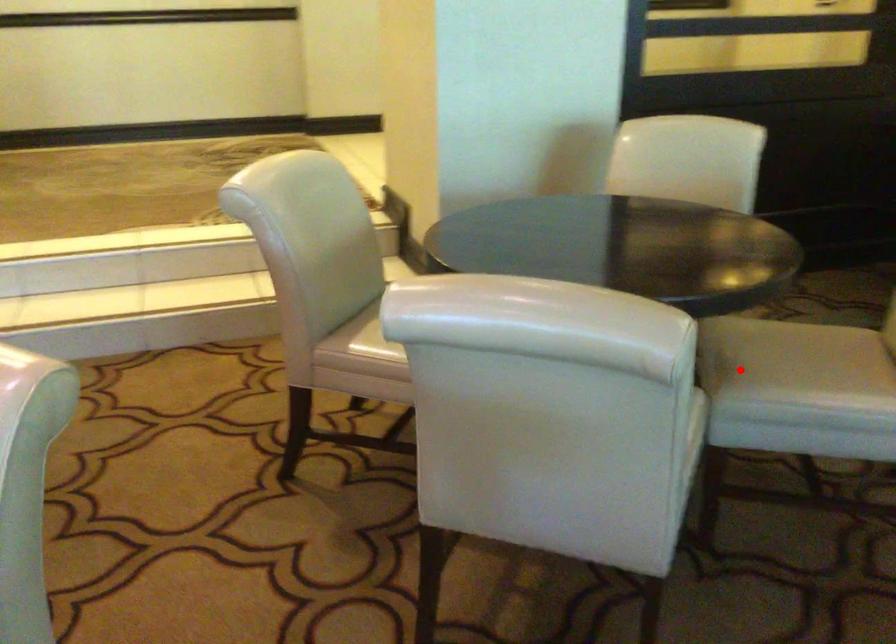
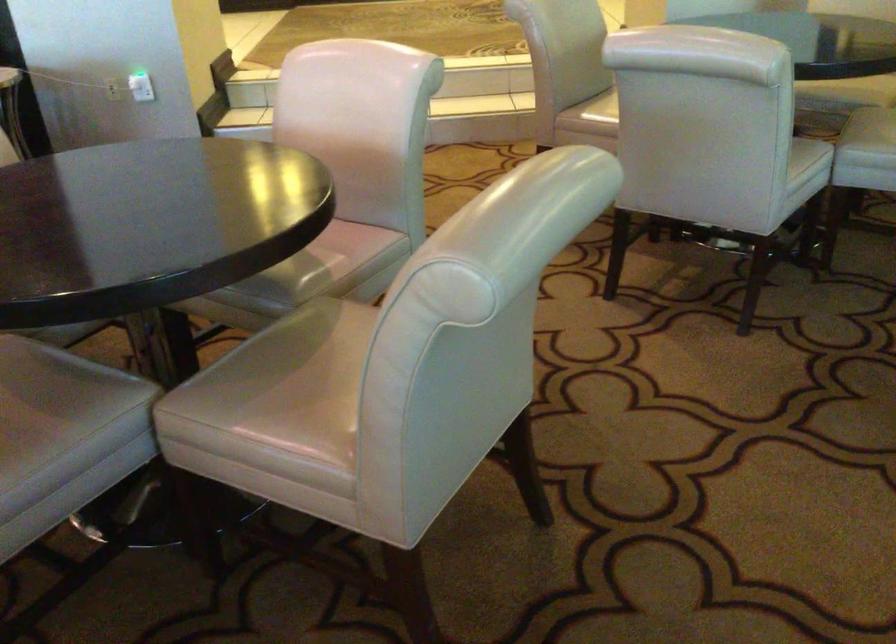
Question: I am providing you with two images of the same scene from different viewpoints. Given a red point in image1, look at the same physical point in image2. Is it:

Choices:
 (A) Closer to the viewpoint
 (B) Farther from the viewpoint

Answer: (B)